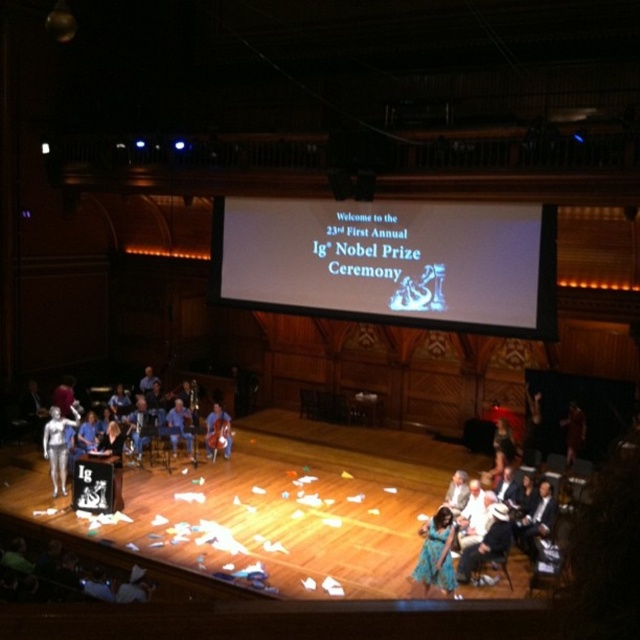
You are an attendee at the Ig Nobel Prize Ceremony. You notice a white paper at center and a smooth brown leather jacket at right. Which object is smaller in size?

The white paper at center is smaller in size compared to the smooth brown leather jacket at right.